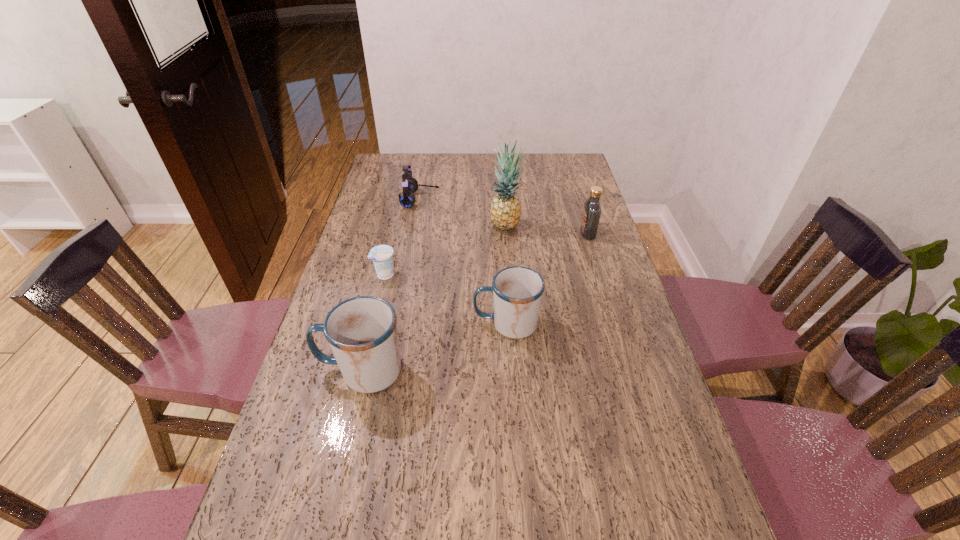
All mugs are currently evenly spaced. To continue this pattern, where would you add another mug on the right? Please point out a vacant spot. Please provide its 2D coordinates. Your answer should be formatted as a tuple, i.e. [(x, y)], where the tuple contains the x and y coordinates of a point satisfying the conditions above.

[(627, 285)]